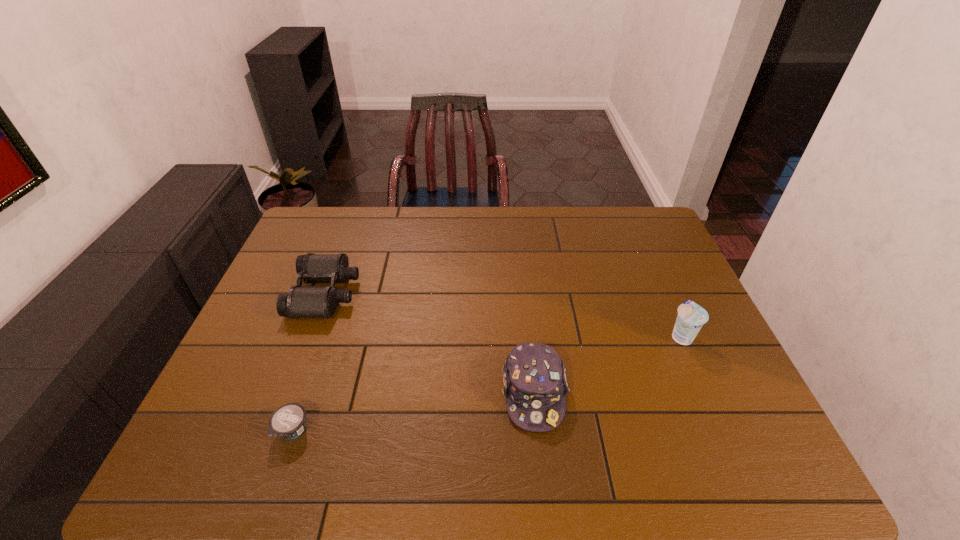
Locate an element on the screen. Image resolution: width=960 pixels, height=540 pixels. headwear is located at coordinates (534, 380).

Locate an element on the screen. the farther yogurt is located at coordinates (691, 317).

Locate an element on the screen. Image resolution: width=960 pixels, height=540 pixels. the taller yogurt is located at coordinates (691, 317).

Where is `binoculars`? binoculars is located at coordinates (301, 301).

This screenshot has height=540, width=960. I want to click on the left yogurt, so click(288, 421).

In order to click on the nearer yogurt in this screenshot , I will do `click(288, 421)`.

The image size is (960, 540). I want to click on vacant space located on the front-facing side of the headwear, so click(x=540, y=456).

This screenshot has height=540, width=960. I want to click on blank space located 0.240m on the front of the right yogurt, so coord(725,434).

This screenshot has width=960, height=540. What are the coordinates of `vacant region located 0.160m through the eyepieces of the binoculars` in the screenshot? It's located at (410, 293).

Identify the location of vacant space positioned 0.180m on the back of the left yogurt. Image resolution: width=960 pixels, height=540 pixels. (320, 352).